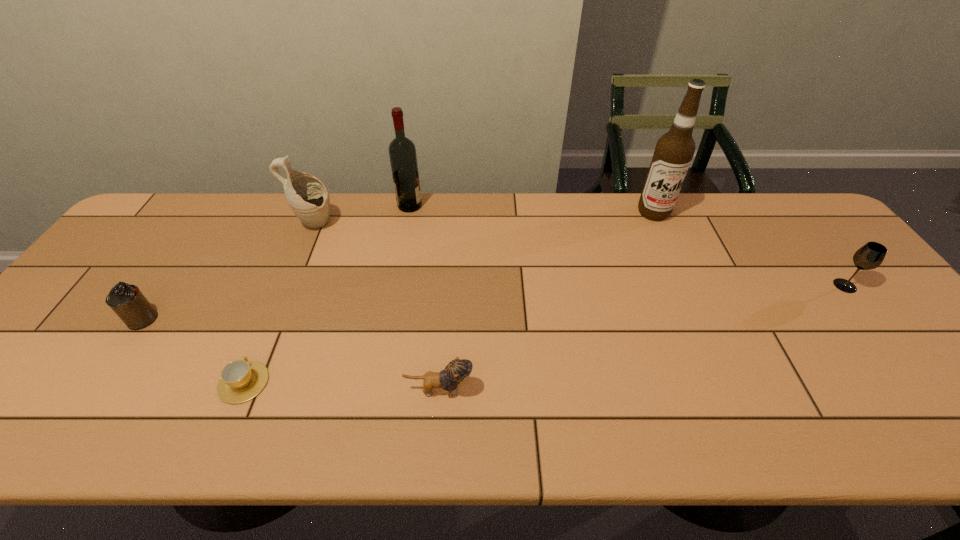
Where is `the taller alcohol`? the taller alcohol is located at coordinates (674, 151).

At what (x,y) coordinates should I click in order to perform the action: click on the sixth object from left to right. Please return your answer as a coordinate pair (x, y). This screenshot has width=960, height=540. Looking at the image, I should click on (674, 151).

You are a GUI agent. You are given a task and a screenshot of the screen. Output one action in this format:
    pyautogui.click(x=<x>, y=<y>)
    Task: Click on the left alcohol
    The width and height of the screenshot is (960, 540).
    Given the screenshot: What is the action you would take?
    pyautogui.click(x=402, y=152)

Image resolution: width=960 pixels, height=540 pixels. Identify the location of the fourth object from right to left. (402, 152).

Where is `pitcher`? Image resolution: width=960 pixels, height=540 pixels. pitcher is located at coordinates (307, 196).

At what (x,y) coordinates should I click in order to perform the action: click on the rightmost object. Please return your answer as a coordinate pair (x, y). Looking at the image, I should click on 871,255.

The image size is (960, 540). Find the location of `the fourth shortest object`. the fourth shortest object is located at coordinates (871, 255).

Locate an element on the screen. the leftmost object is located at coordinates (127, 301).

The width and height of the screenshot is (960, 540). Identify the location of the third nearest object. (127, 301).

This screenshot has width=960, height=540. Find the location of `the fifth object from left to right`. the fifth object from left to right is located at coordinates (457, 370).